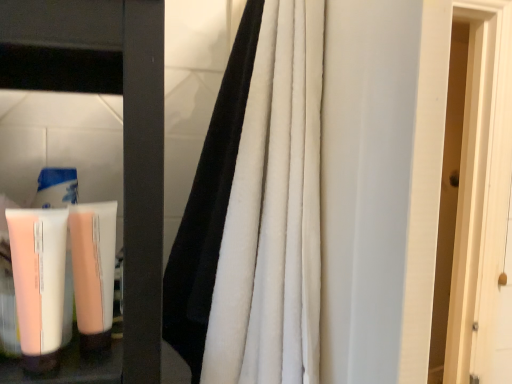
Image resolution: width=512 pixels, height=384 pixels. What do you see at coordinates (256, 211) in the screenshot?
I see `black velvet curtain at center` at bounding box center [256, 211].

What do you see at coordinates (93, 271) in the screenshot?
I see `pale pink matte tube at lower left` at bounding box center [93, 271].

Image resolution: width=512 pixels, height=384 pixels. What do you see at coordinates (39, 283) in the screenshot?
I see `pink matte tube at lower left` at bounding box center [39, 283].

Identify the location of black velvet curtain at center. The height and width of the screenshot is (384, 512). (256, 211).

Considering the relative positions of pink matte tube at lower left and black velvet curtain at center in the image provided, is pink matte tube at lower left behind black velvet curtain at center?

That is True.

Based on the photo, in terms of width, does pink matte tube at lower left look wider or thinner when compared to black velvet curtain at center?

Clearly, pink matte tube at lower left has less width compared to black velvet curtain at center.

In the scene shown: Can you confirm if pink matte tube at lower left is positioned to the right of black velvet curtain at center?

No, pink matte tube at lower left is not to the right of black velvet curtain at center.

Is point (38, 232) closer or farther from the camera than point (247, 236)?

Point (38, 232).

Is pale pink matte tube at lower left completely or partially inside pink matte tube at lower left?

Actually, pale pink matte tube at lower left is outside pink matte tube at lower left.

At what (x,y) coordinates should I click in order to perform the action: click on shaving cream located on the right of pink matte tube at lower left. Please return your answer as a coordinate pair (x, y). Looking at the image, I should click on (93, 271).

Consider the image. Is pink matte tube at lower left far away from pale pink matte tube at lower left?

pink matte tube at lower left is actually quite close to pale pink matte tube at lower left.

From a real-world perspective, which is physically above, pink matte tube at lower left or pale pink matte tube at lower left?

pink matte tube at lower left is physically above.

From a real-world perspective, is black velvet curtain at center on top of pale pink matte tube at lower left?

Result: Yes, from a real-world perspective, black velvet curtain at center is over pale pink matte tube at lower left

Can pale pink matte tube at lower left be found inside black velvet curtain at center?

No, pale pink matte tube at lower left is located outside of black velvet curtain at center.

Could you tell me if black velvet curtain at center is facing pale pink matte tube at lower left?

Yes, black velvet curtain at center faces towards pale pink matte tube at lower left.

Find the location of a particular element. This screenshot has width=512, height=384. shaving cream beneath the black velvet curtain at center (from a real-world perspective) is located at coordinates (93, 271).

Does point (81, 279) appear closer or farther from the camera than point (265, 193)?

Point (81, 279).

From a real-world perspective, between pale pink matte tube at lower left and black velvet curtain at center, who is vertically higher?

In real-world perspective, black velvet curtain at center is above.

From their relative heights in the image, would you say pale pink matte tube at lower left is taller or shorter than black velvet curtain at center?

Considering their sizes, pale pink matte tube at lower left has less height than black velvet curtain at center.

Measure the distance between pale pink matte tube at lower left and pink matte tube at lower left.

They are 2.22 inches apart.

Considering the sizes of objects pale pink matte tube at lower left and pink matte tube at lower left in the image provided, who is bigger, pale pink matte tube at lower left or pink matte tube at lower left?

pink matte tube at lower left is bigger.

Which is more to the right, pale pink matte tube at lower left or pink matte tube at lower left?

Positioned to the right is pale pink matte tube at lower left.

Based on the photo, does pale pink matte tube at lower left come behind pink matte tube at lower left?

Yes, pale pink matte tube at lower left is further from the camera.

This screenshot has width=512, height=384. What are the coordinates of `curtain located above the pink matte tube at lower left (from the image's perspective)` in the screenshot? It's located at (256, 211).

From the image's perspective, who appears lower, black velvet curtain at center or pink matte tube at lower left?

pink matte tube at lower left is shown below in the image.

Does black velvet curtain at center appear on the right side of pink matte tube at lower left?

Correct, you'll find black velvet curtain at center to the right of pink matte tube at lower left.

The height and width of the screenshot is (384, 512). In order to click on curtain in front of the pink matte tube at lower left in this screenshot , I will do `click(256, 211)`.

Where is `shaving cream that appears behind the pink matte tube at lower left`? This screenshot has width=512, height=384. shaving cream that appears behind the pink matte tube at lower left is located at coordinates (93, 271).

Based on the photo, estimate the real-world distances between objects in this image. Which object is further from pale pink matte tube at lower left, black velvet curtain at center or pink matte tube at lower left?

Based on the image, black velvet curtain at center appears to be further to pale pink matte tube at lower left.

From the picture: Looking at the image, which one is located closer to black velvet curtain at center, pale pink matte tube at lower left or pink matte tube at lower left?

pale pink matte tube at lower left.

When comparing their distances from pale pink matte tube at lower left, does pink matte tube at lower left or black velvet curtain at center seem closer?

pink matte tube at lower left is closer to pale pink matte tube at lower left.

Looking at the image, which one is located closer to pink matte tube at lower left, black velvet curtain at center or pale pink matte tube at lower left?

pale pink matte tube at lower left is positioned closer to the anchor pink matte tube at lower left.

Based on their spatial positions, is pink matte tube at lower left or pale pink matte tube at lower left further from black velvet curtain at center?

pink matte tube at lower left.

Looking at the image, which one is located further to pink matte tube at lower left, pale pink matte tube at lower left or black velvet curtain at center?

black velvet curtain at center lies further to pink matte tube at lower left than the other object.

Find the location of a particular element. The width and height of the screenshot is (512, 384). shaving cream situated between pink matte tube at lower left and black velvet curtain at center from left to right is located at coordinates point(93,271).